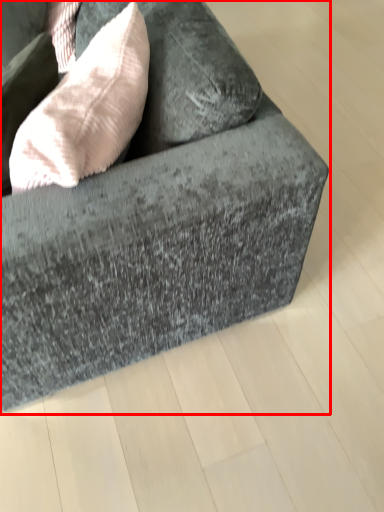
Question: From the image's perspective, where is studio couch (annotated by the red box) located relative to throw pillow?

Choices:
 (A) above
 (B) below

Answer: (A)